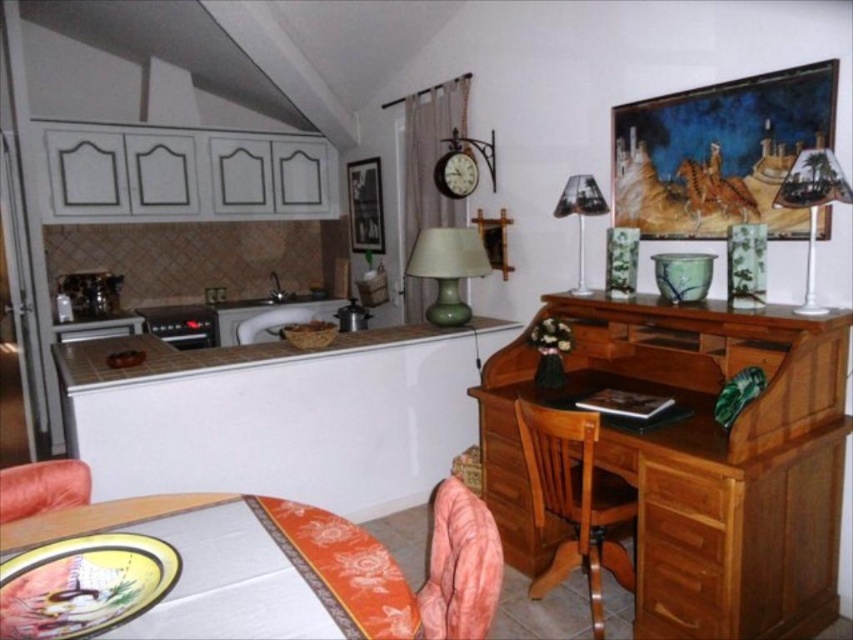
You are planning to place a large rectangular cake on the white glossy table at lower left and the brown fabric armchair at left. Which surface can accommodate the cake without it hanging over the edge?

The white glossy table at lower left has a larger size compared to the brown fabric armchair at left, so the cake can be placed on the white glossy table at lower left without it hanging over the edge.

You are sitting in the brown fabric armchair at left and want to place a book on the white glossy table at lower left. Can you reach the table from your current position without moving your chair?

The white glossy table at lower left is positioned under the brown fabric armchair at left, meaning it is directly beneath the chair. Since the table is under the chair, you can easily reach it without needing to move your chair.

You are standing in the kitchen and living area and want to move from the dining table to the wooden desk. Which point, point (822,506) or point (573,193), is closer to the wooden desk?

Point (822,506) is closer to the wooden desk because it is in front of point (573,193), meaning it is positioned between the desk and the observer.